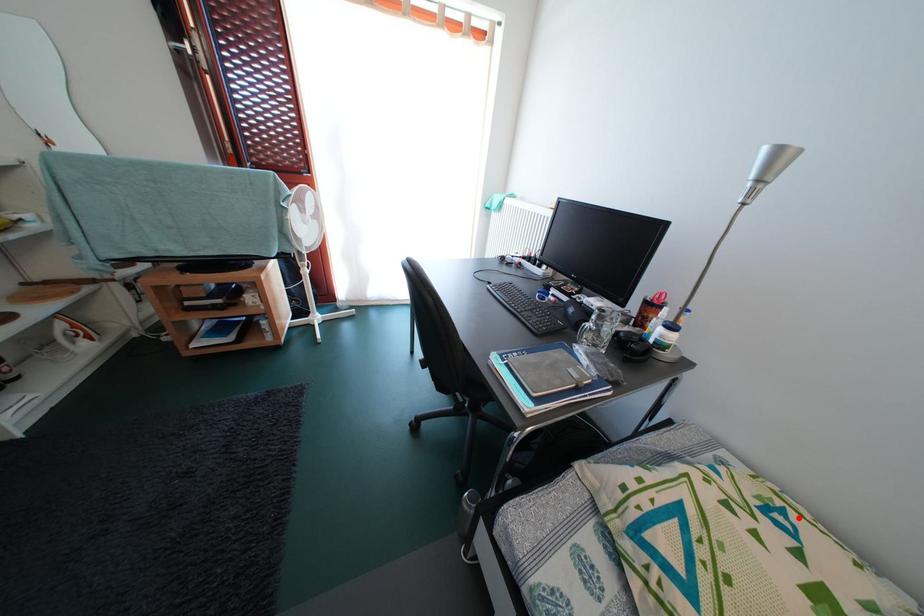
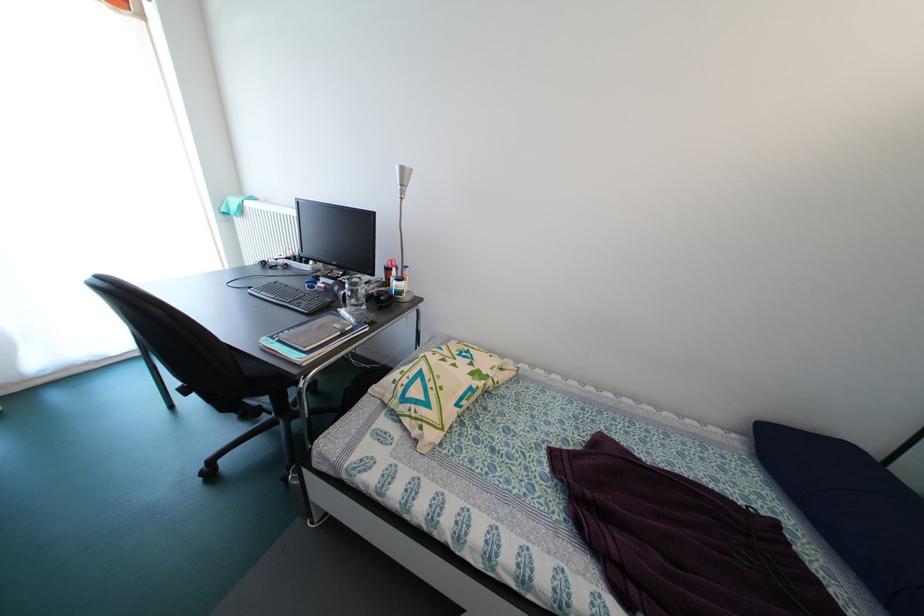
In the second image, find the point that corresponds to the highlighted location in the first image.

(479, 355)